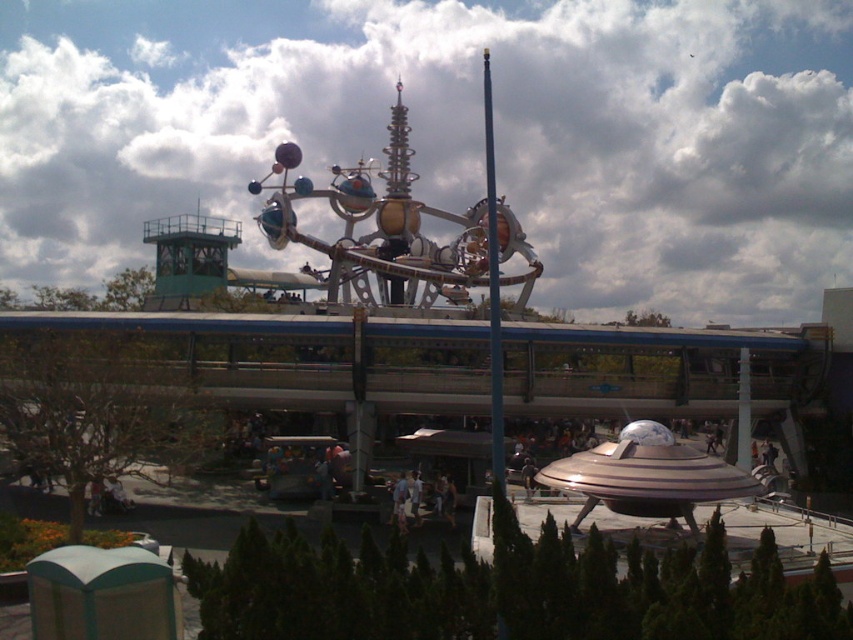
Is metallic silver amusement ride at center smaller than metallic pole at center?

Actually, metallic silver amusement ride at center might be larger than metallic pole at center.

Is metallic silver amusement ride at center behind metallic pole at center?

That is True.

Is point (274, 192) farther from viewer compared to point (496, 307)?

Yes, point (274, 192) is farther from viewer.

Locate an element on the screen. The width and height of the screenshot is (853, 640). metallic silver amusement ride at center is located at coordinates (401, 227).